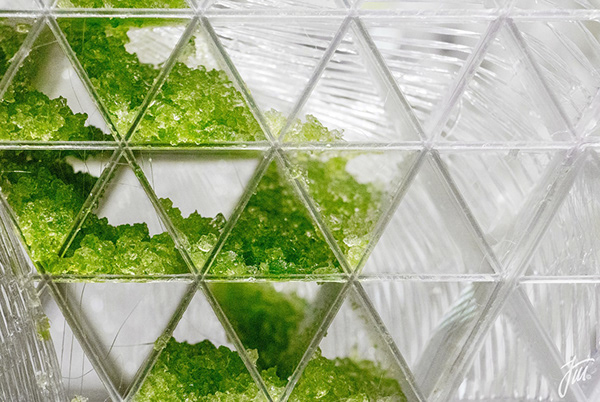
Find the location of `bottom horizontal glass panel shown in image`. bottom horizontal glass panel shown in image is located at coordinates (411, 276), (38, 277), (134, 277), (276, 277), (566, 278).